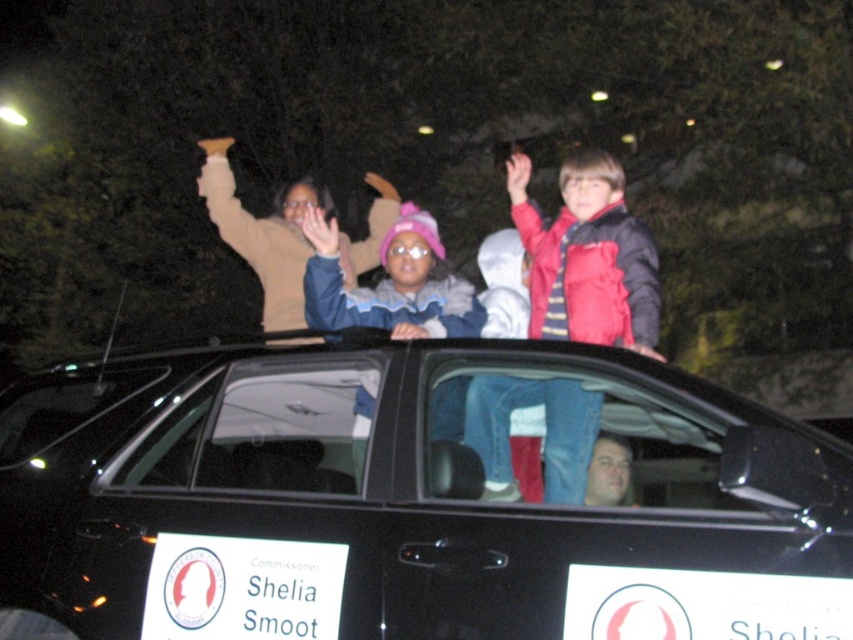
Between red fleece jacket at upper right and blue fleece jacket at center, which one appears on the right side from the viewer's perspective?

red fleece jacket at upper right is more to the right.

Is point (593, 326) farther from viewer compared to point (310, 296)?

That is False.

Identify the location of red fleece jacket at upper right. Image resolution: width=853 pixels, height=640 pixels. (587, 257).

Does black matte car at center appear under red fleece jacket at upper right?

Correct, black matte car at center is located below red fleece jacket at upper right.

Does point (474, 348) come in front of point (651, 316)?

Yes, point (474, 348) is in front of point (651, 316).

Find the location of a particular element. The image size is (853, 640). black matte car at center is located at coordinates (412, 499).

Is point (756, 436) closer to camera compared to point (376, 301)?

Yes, it is in front of point (376, 301).

Who is positioned more to the right, black matte car at center or blue fleece jacket at center?

blue fleece jacket at center is more to the right.

What do you see at coordinates (412, 499) in the screenshot? This screenshot has width=853, height=640. I see `black matte car at center` at bounding box center [412, 499].

Locate an element on the screen. black matte car at center is located at coordinates (412, 499).